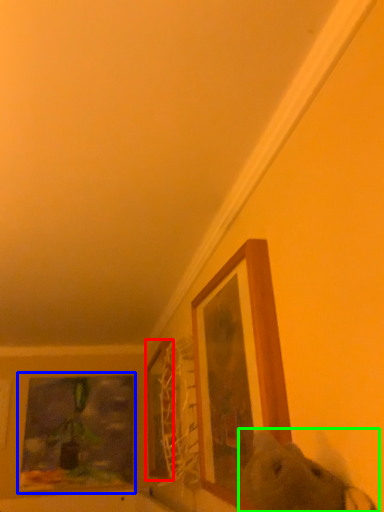
Question: Based on their relative distances, which object is nearer to picture frame (highlighted by a red box)? Choose from picture frame (highlighted by a blue box) and animal (highlighted by a green box).

Choices:
 (A) picture frame
 (B) animal

Answer: (A)